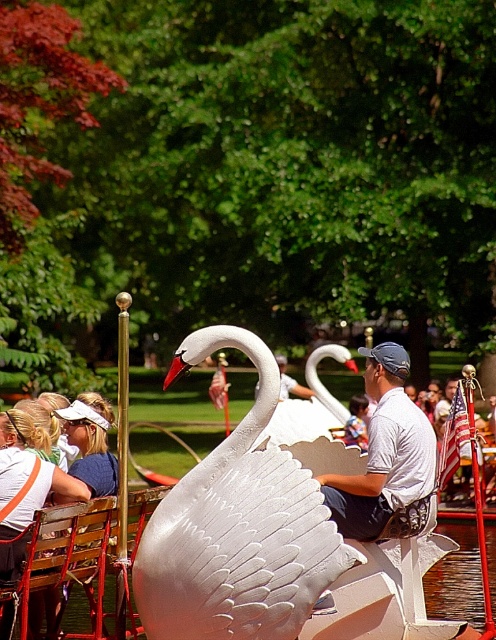
Which is more to the right, white glossy swan at center or white matte swan at center?

white matte swan at center

Is white glossy swan at center below white matte swan at center?

Correct, white glossy swan at center is located below white matte swan at center.

Locate an element on the screen. The height and width of the screenshot is (640, 496). white glossy swan at center is located at coordinates (238, 528).

Is white glossy swan at center further to the viewer compared to wooden chair at lower left?

No, it is not.

In the scene shown: Can you confirm if white glossy swan at center is positioned below wooden chair at lower left?

No.

What do you see at coordinates (238, 528) in the screenshot? I see `white glossy swan at center` at bounding box center [238, 528].

This screenshot has width=496, height=640. In order to click on white glossy swan at center in this screenshot , I will do `click(238, 528)`.

Can you confirm if white matte swan at center is thinner than wooden chair at lower left?

No, white matte swan at center is not thinner than wooden chair at lower left.

Is white matte swan at center to the left of wooden chair at lower left from the viewer's perspective?

Incorrect, white matte swan at center is not on the left side of wooden chair at lower left.

Locate an element on the screen. The height and width of the screenshot is (640, 496). white matte swan at center is located at coordinates (384, 451).